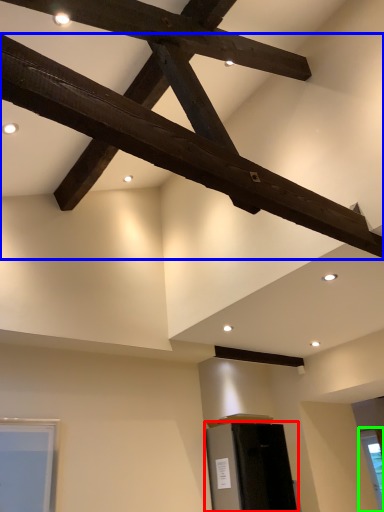
Question: Which is nearer to the furniture (highlighted by a red box)? beam (highlighted by a blue box) or window (highlighted by a green box).

Choices:
 (A) beam
 (B) window

Answer: (B)